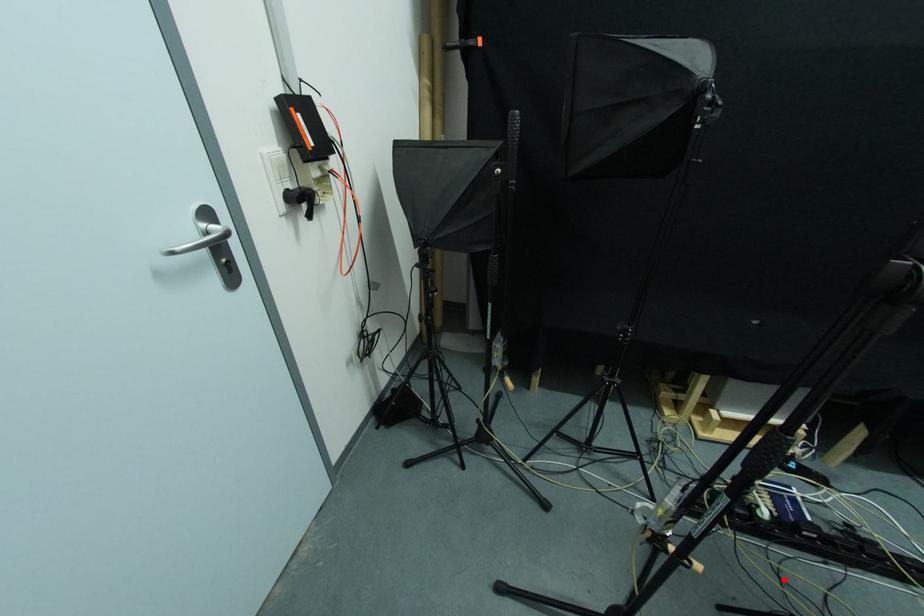
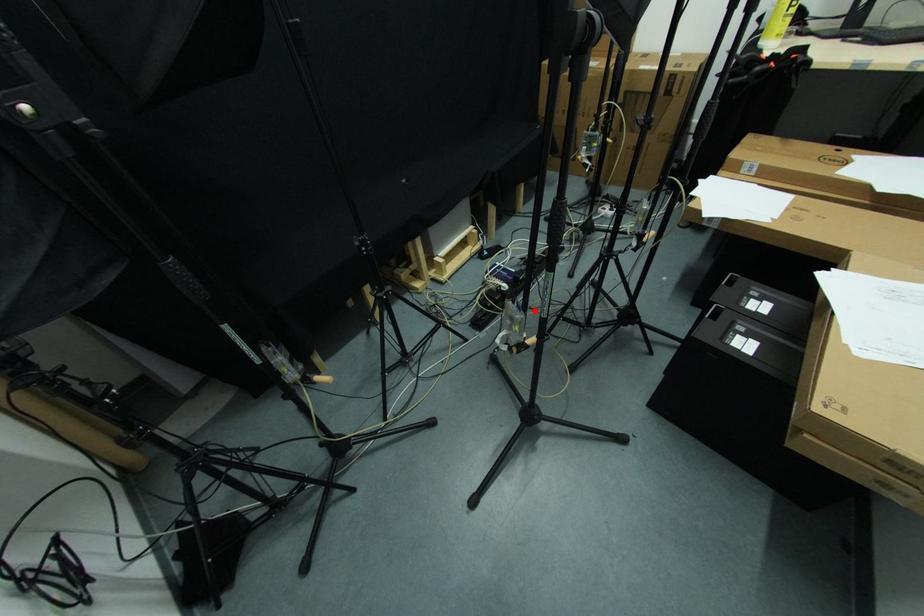
I am providing you with two images of the same scene from different viewpoints. A red point is marked on the first image and another point is marked on the second image. Is the marked point in image1 the same physical position as the marked point in image2?

Yes